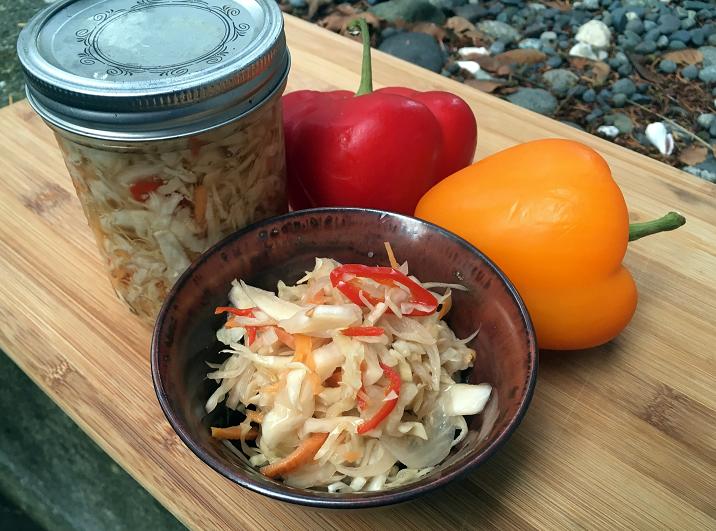
The image size is (716, 531). I want to click on ceramic bowl, so click(497, 341).